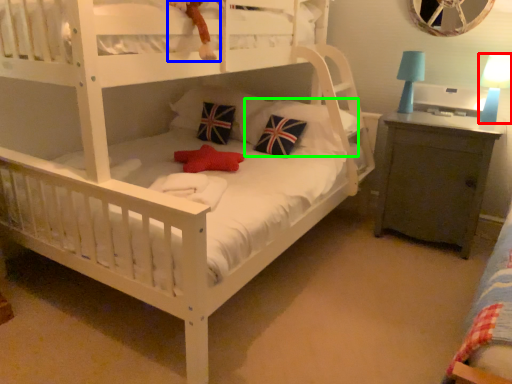
Question: Estimate the real-world distances between objects in this image. Which object is closer to table lamp (highlighted by a red box), toy (highlighted by a blue box) or pillow (highlighted by a green box)?

Choices:
 (A) toy
 (B) pillow

Answer: (B)